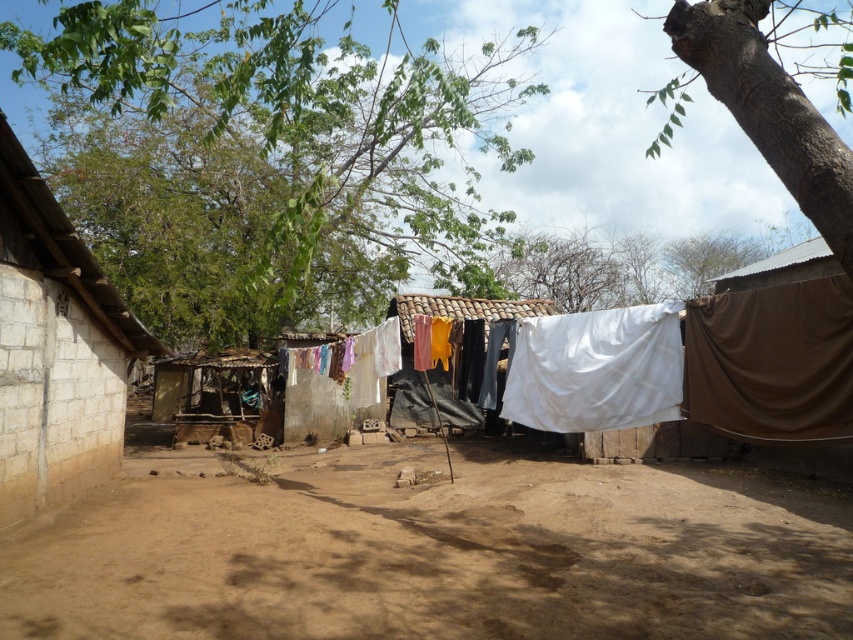
Question: Does green leafy tree at upper center appear under light beige concrete hut at left?

Choices:
 (A) no
 (B) yes

Answer: (A)

Question: Based on their relative distances, which object is nearer to the green leafy tree at upper center?

Choices:
 (A) brown rough bark tree at upper right
 (B) brown dirt field at center

Answer: (B)

Question: In this image, where is brown dirt field at center located relative to brown rough bark tree at upper right?

Choices:
 (A) right
 (B) left

Answer: (B)

Question: Does light beige concrete hut at left lie behind brown rough bark tree at upper right?

Choices:
 (A) yes
 (B) no

Answer: (A)

Question: Which of the following is the closest to the observer?

Choices:
 (A) (741, 36)
 (B) (374, 480)

Answer: (A)

Question: Estimate the real-world distances between objects in this image. Which object is closer to the brown rough bark tree at upper right?

Choices:
 (A) brown dirt field at center
 (B) white fabric at center
 (C) green leafy tree at upper center

Answer: (B)